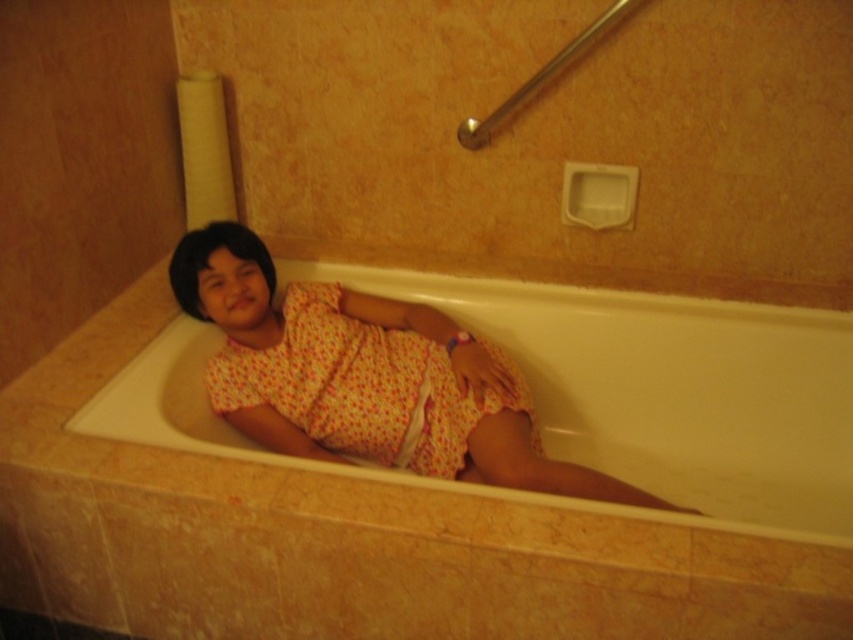
Looking at this image, you are a photographer taking a picture of the bathroom scene. You need to position your camera to capture the floral fabric dress at center clearly. Based on the coordinates provided, where should you aim your camera?

You should aim your camera at the coordinates point (364, 376) to capture the floral fabric dress at center clearly.

You are a photographer trying to capture the child in the bathtub. You notice two dresses labeled as floral fabric dress at center and floral cotton dress at center. Which dress is closer to the camera?

The floral fabric dress at center is closer to the camera because it is in front of the floral cotton dress at center.